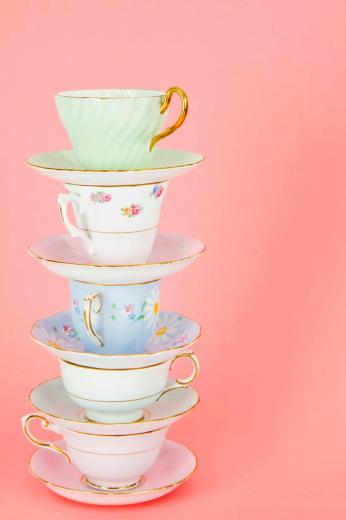
At what (x,y) coordinates should I click in order to perform the action: click on blue china. Please return your answer as a coordinate pair (x, y). Looking at the image, I should click on (134, 329), (164, 343), (65, 337).